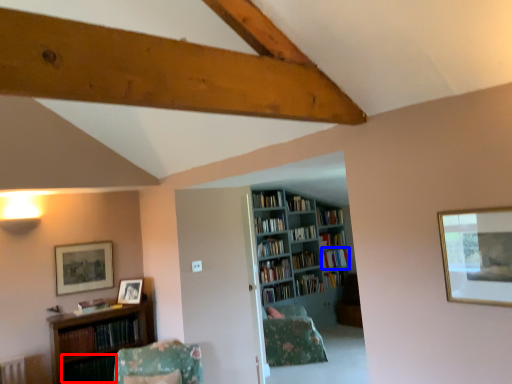
Question: Which point is closer to the camera, book (highlighted by a red box) or book (highlighted by a blue box)?

Choices:
 (A) book
 (B) book

Answer: (A)